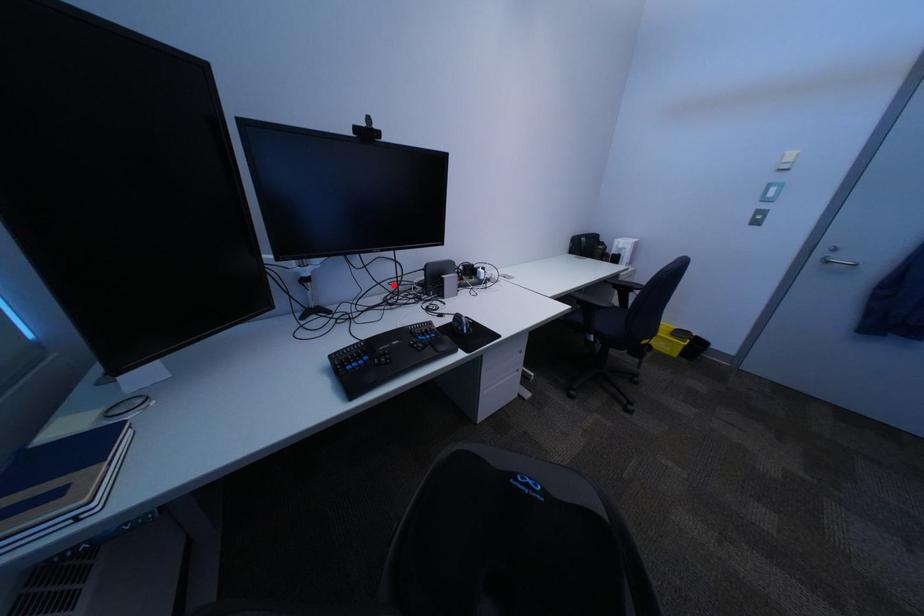
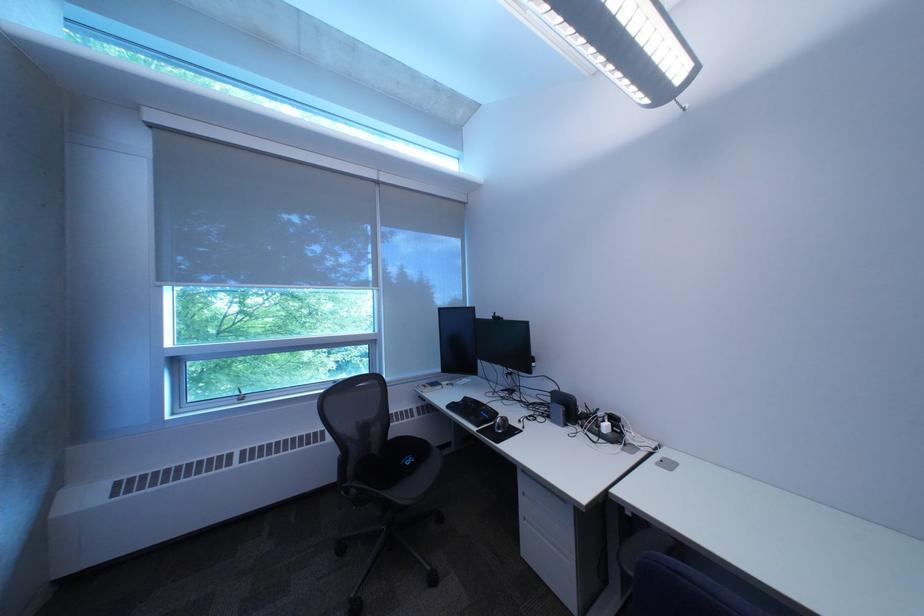
Where in the second image is the point corresponding to the highlighted location from the first image?

(532, 387)